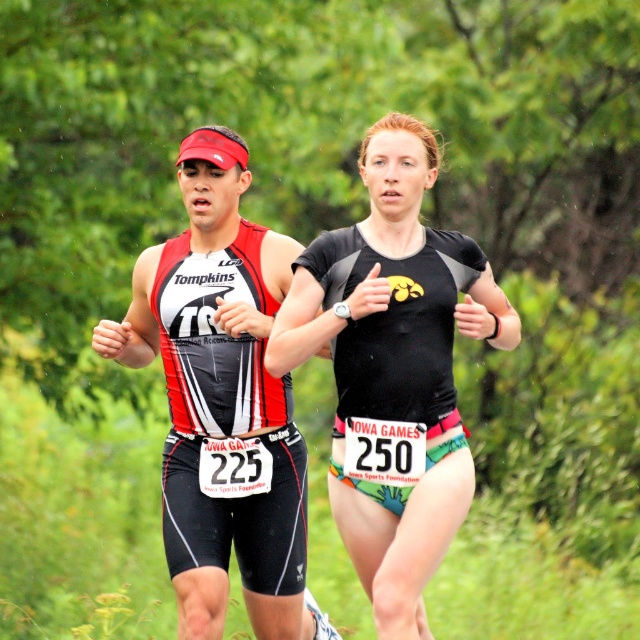
You are a photographer at the Iowa Games trying to capture the athletes in the image. You notice two athletes wearing black matte running suit at center and matte triathlon suit at center. Which athlete is positioned higher in the frame?

The black matte running suit at center is located above the matte triathlon suit at center, so the athlete wearing the black matte running suit at center is positioned higher in the frame.

You are a photographer standing at the starting line of the Iowa Games triathlon. You want to capture a closeup shot of the black matte running suit at center. Given that your camera has a minimum focusing distance of 5 meters, will you be able to take the photo without moving closer?

The black matte running suit at center is 5.42 meters away from the viewer. Since the camera can focus as close as 5 meters, the photographer can take the closeup shot without moving closer because the distance is within the camera